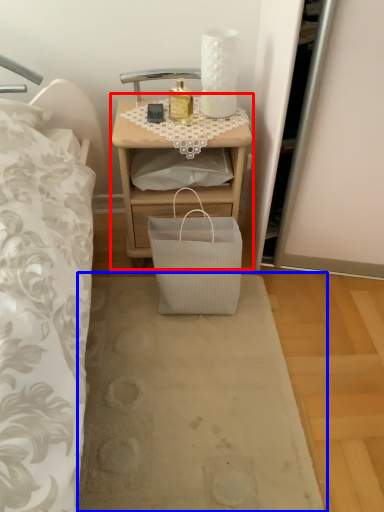
Question: Which object is closer to the camera taking this photo, nightstand (highlighted by a red box) or plain (highlighted by a blue box)?

Choices:
 (A) nightstand
 (B) plain

Answer: (B)